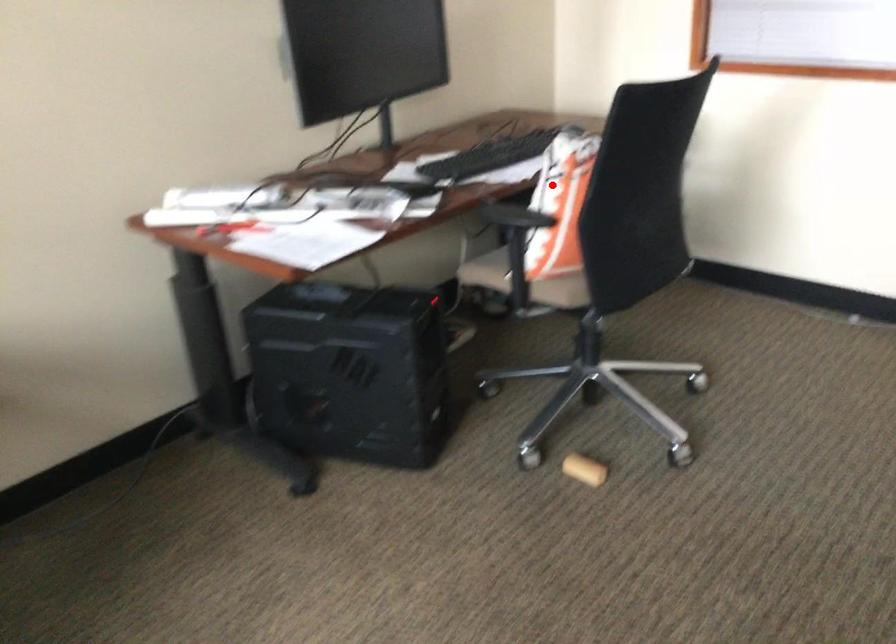
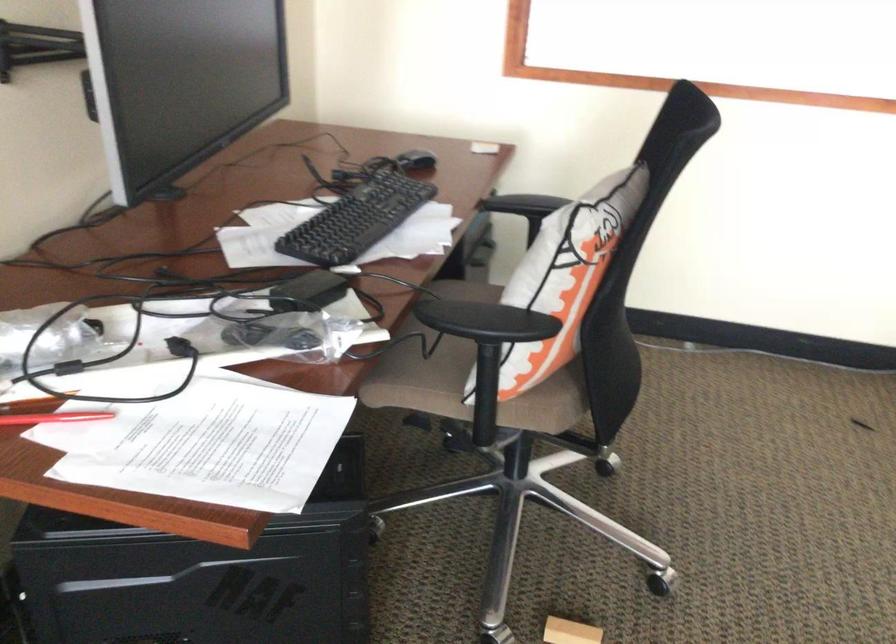
Question: A red point is marked in image1. In image2, is the corresponding 3D point closer to the camera or farther? Reply with the corresponding letter.

Choices:
 (A) The corresponding 3D point is closer.
 (B) The corresponding 3D point is farther.

Answer: (A)